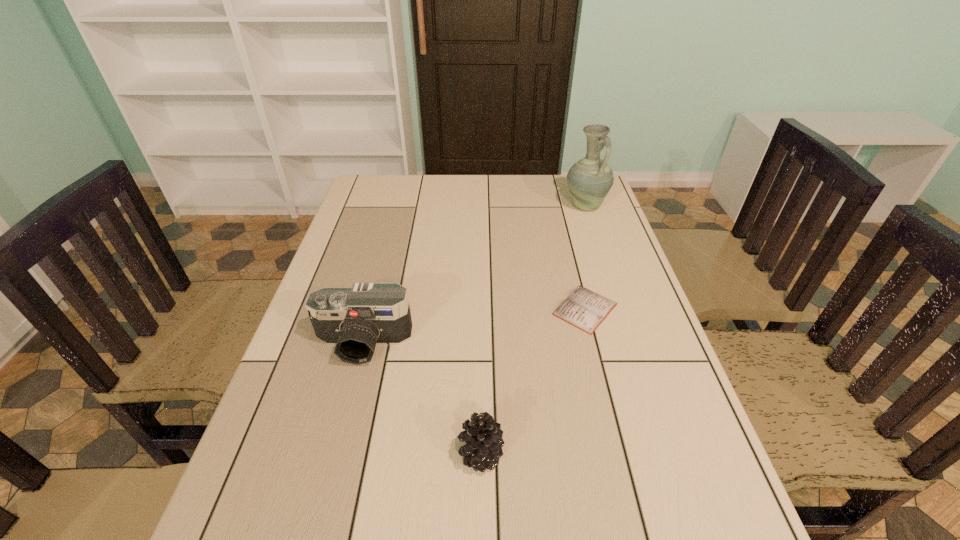
At what (x,y) coordinates should I click in order to perform the action: click on the farthest object. Please return your answer as a coordinate pair (x, y). This screenshot has height=540, width=960. Looking at the image, I should click on (589, 180).

Identify the location of pitcher. (589, 180).

Identify the location of camera. The width and height of the screenshot is (960, 540). pyautogui.click(x=355, y=319).

Where is `the nearest object`? This screenshot has width=960, height=540. the nearest object is located at coordinates coord(483,438).

The height and width of the screenshot is (540, 960). I want to click on the third tallest object, so click(x=483, y=438).

Locate an element on the screen. the shortest object is located at coordinates (584, 309).

Locate an element on the screen. This screenshot has width=960, height=540. vacant space situated 0.200m on the handle side of the farthest object is located at coordinates (602, 255).

This screenshot has height=540, width=960. What are the coordinates of `free space located 0.270m on the front-facing side of the leftmost object` in the screenshot? It's located at (325, 488).

At what (x,y) coordinates should I click in order to perform the action: click on vacant space located on the back of the pinecone. Please return your answer as a coordinate pair (x, y). This screenshot has width=960, height=540. Looking at the image, I should click on (481, 338).

This screenshot has width=960, height=540. I want to click on vacant space located on the front of the diary, so click(632, 496).